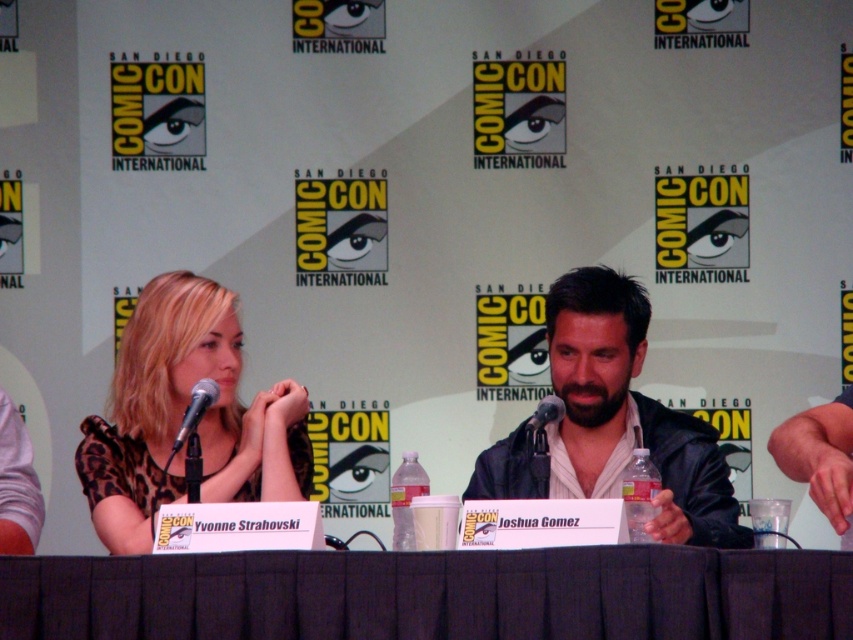
Is point (184, 432) in front of point (548, 412)?

Yes.

Can you confirm if silver metallic microphone at center is bigger than black plastic microphone at center?

Correct, silver metallic microphone at center is larger in size than black plastic microphone at center.

Who is more forward, (190, 401) or (544, 406)?

Positioned in front is point (544, 406).

Where is `silver metallic microphone at center`? This screenshot has width=853, height=640. silver metallic microphone at center is located at coordinates (195, 410).

Is point (155, 396) closer to camera compared to point (199, 408)?

No, (155, 396) is behind (199, 408).

Locate an element on the screen. This screenshot has width=853, height=640. leopard print dress at center is located at coordinates (183, 417).

Is point (142, 419) less distant than point (177, 436)?

No.

I want to click on leopard print dress at center, so click(x=183, y=417).

Can you confirm if black leather jacket at center is positioned below silver metallic microphone at center?

Yes, black leather jacket at center is below silver metallic microphone at center.

From the picture: Measure the distance between point (602,368) and camera.

3.73 meters

The width and height of the screenshot is (853, 640). What are the coordinates of `black leather jacket at center` in the screenshot? It's located at (612, 420).